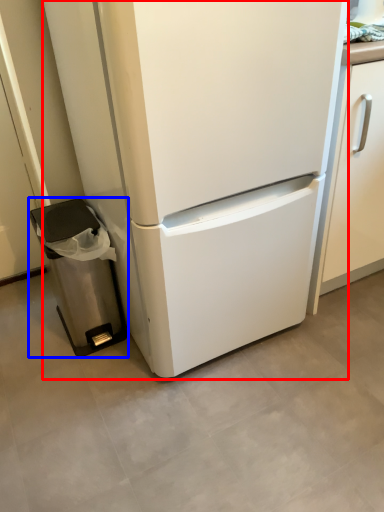
Question: Which point is closer to the camera, refrigerator (highlighted by a red box) or trash bin/can (highlighted by a blue box)?

Choices:
 (A) refrigerator
 (B) trash bin/can

Answer: (A)